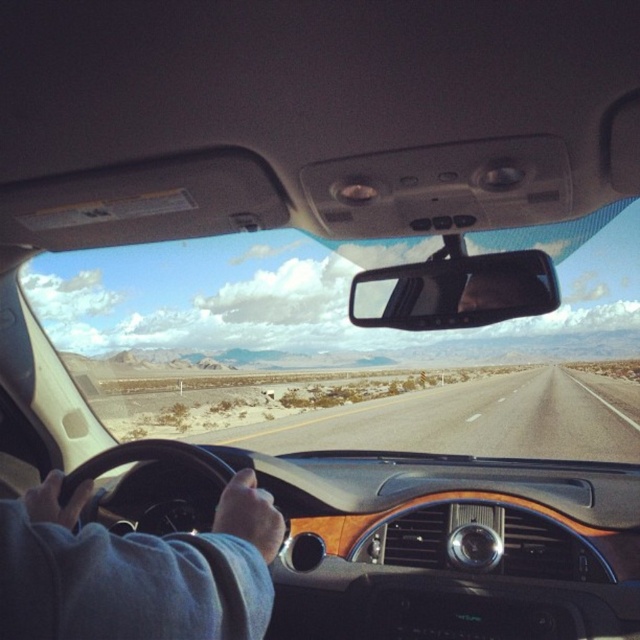
Question: Estimate the real-world distances between objects in this image. Which object is closer to the asphalt road at center?

Choices:
 (A) transparent glass windshield at center
 (B) black plastic view mirror at center
 (C) blue fleece jacket at lower left

Answer: (A)

Question: From the image, what is the correct spatial relationship of transparent glass windshield at center in relation to black plastic view mirror at center?

Choices:
 (A) left
 (B) right

Answer: (B)

Question: Observing the image, what is the correct spatial positioning of transparent glass windshield at center in reference to asphalt road at center?

Choices:
 (A) below
 (B) above

Answer: (B)

Question: Which object is the closest to the black plastic view mirror at center?

Choices:
 (A) blue fleece jacket at lower left
 (B) transparent glass windshield at center

Answer: (A)

Question: Considering the real-world distances, which object is closest to the transparent glass windshield at center?

Choices:
 (A) asphalt road at center
 (B) black plastic view mirror at center
 (C) blue fleece jacket at lower left

Answer: (A)

Question: Is blue fleece jacket at lower left bigger than black plastic view mirror at center?

Choices:
 (A) no
 (B) yes

Answer: (A)